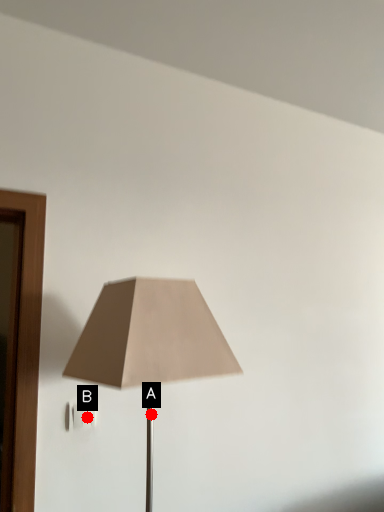
Question: Two points are circled on the image, labeled by A and B beside each circle. Which point is closer to the camera?

Choices:
 (A) A is closer
 (B) B is closer

Answer: (B)